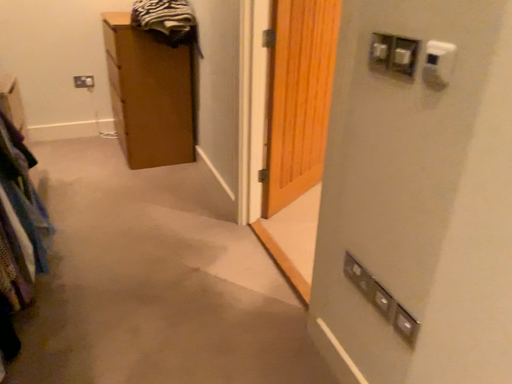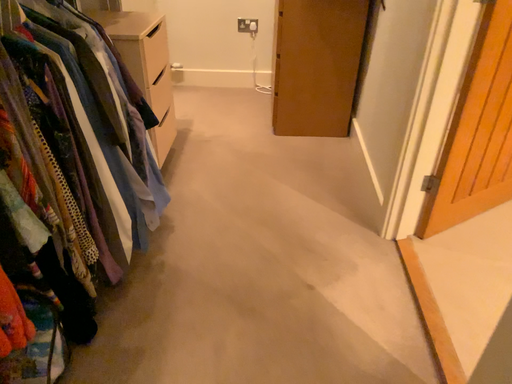
Question: Which way did the camera rotate in the video?

Choices:
 (A) rotated left
 (B) rotated right

Answer: (A)